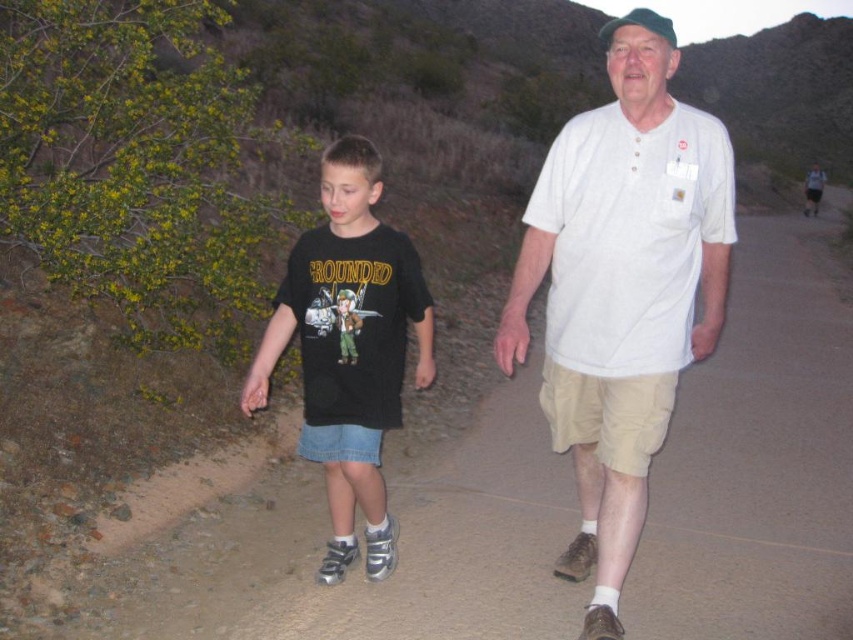
You are a photographer trying to capture the scene. You want to focus on the point at coordinate (622, 289). Which object from the scene should you adjust your camera to focus on?

The point at coordinate (622, 289) is on the white cotton shirt at center, so you should adjust your camera to focus on the white cotton shirt at center.